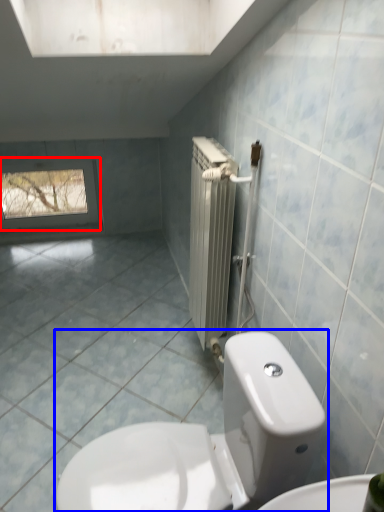
Question: Which object appears closest to the camera in this image, window (highlighted by a red box) or toilet (highlighted by a blue box)?

Choices:
 (A) window
 (B) toilet

Answer: (B)